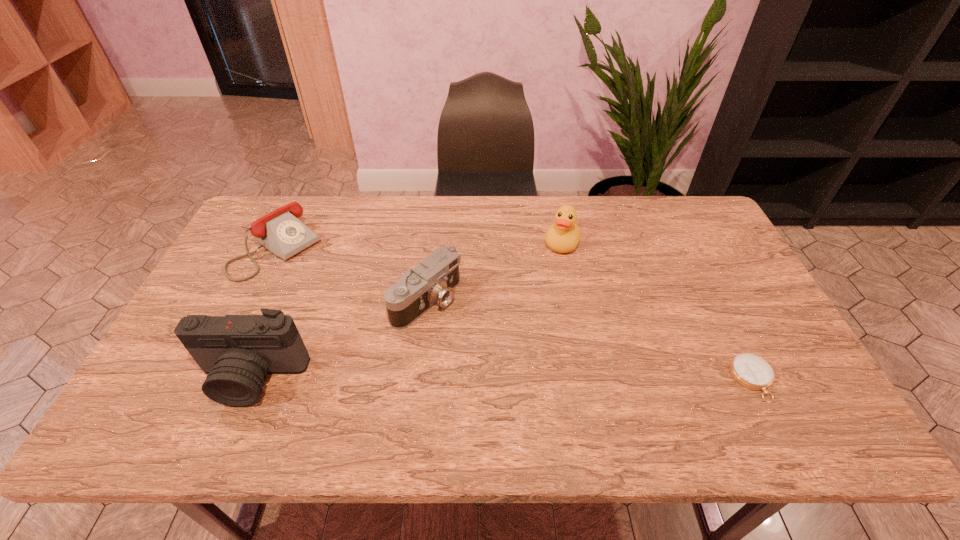
Where is `free space on the desktop that is between the nearer camera and the compass and is positioned on the lens of the third object from right to left`? free space on the desktop that is between the nearer camera and the compass and is positioned on the lens of the third object from right to left is located at coordinates (545, 379).

In order to click on free space on the desktop that is between the left camera and the shortest object and is positioned at the beak of the second object from right to left in this screenshot , I will do `click(509, 379)`.

The height and width of the screenshot is (540, 960). I want to click on free spot on the desktop that is between the nearer camera and the shortest object and is positioned on the dial of the second shortest object, so click(444, 379).